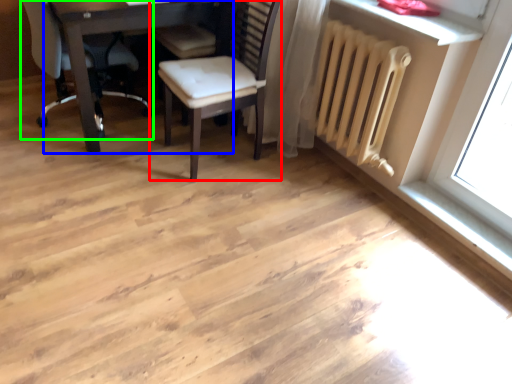
Question: Which object is the farthest from chair (highlighted by a red box)? Choose among these: table (highlighted by a blue box) or chair (highlighted by a green box).

Choices:
 (A) table
 (B) chair

Answer: (B)